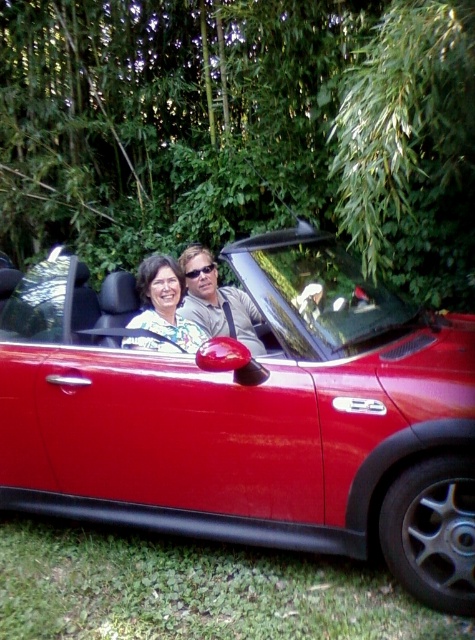
You are a photographer trying to capture a clear shot of the glossy red car at center and the matte black couple at center. Based on their positions, which object is closer to the camera?

The glossy red car at center is located below the matte black couple at center, meaning the couple is closer to the camera.

You are standing at the point marked as point (459, 499). You want to throw a ball to your friend who is 2.39 meters away from you. If the distance between you and your friend is exactly 2.39 meters, can you accurately throw the ball to reach them without it going past?

Yes, since the distance between you and your friend is exactly 2.39 meters, you can throw the ball precisely that distance to reach them without overshooting.

You are a photographer planning to take a wide shot of the glossy red car at center and the matte black couple at center. Based on their sizes, which object should you position closer to the camera to ensure both fit within the frame?

Since the glossy red car at center is wider than the matte black couple at center, you should position the glossy red car at center closer to the camera to ensure both fit within the frame.